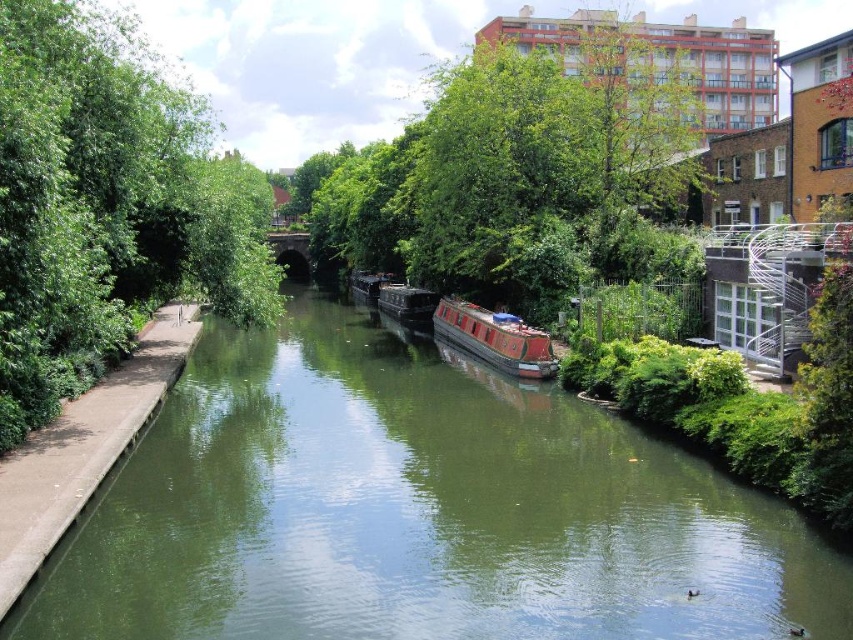
Is green smooth water at center thinner than red polished wood barge at center?

In fact, green smooth water at center might be wider than red polished wood barge at center.

Between green smooth water at center and red polished wood barge at center, which one is positioned higher?

Positioned higher is red polished wood barge at center.

Where is `green smooth water at center`? This screenshot has width=853, height=640. green smooth water at center is located at coordinates (419, 509).

Does green leafy tree at upper center have a lesser height compared to red polished wood barge at center?

In fact, green leafy tree at upper center may be taller than red polished wood barge at center.

Describe the element at coordinates (517, 176) in the screenshot. I see `green leafy tree at upper center` at that location.

This screenshot has width=853, height=640. Describe the element at coordinates (517, 176) in the screenshot. I see `green leafy tree at upper center` at that location.

At what (x,y) coordinates should I click in order to perform the action: click on green leafy tree at upper center. Please return your answer as a coordinate pair (x, y). The width and height of the screenshot is (853, 640). Looking at the image, I should click on (517, 176).

Can you confirm if green leafy tree at left is positioned to the right of wooden barge at center?

Incorrect, green leafy tree at left is not on the right side of wooden barge at center.

Does green leafy tree at left appear on the left side of wooden barge at center?

Yes, green leafy tree at left is to the left of wooden barge at center.

You are a GUI agent. You are given a task and a screenshot of the screen. Output one action in this format:
    pyautogui.click(x=<x>, y=<y>)
    Task: Click on the green leafy tree at left
    
    Given the screenshot: What is the action you would take?
    pyautogui.click(x=106, y=208)